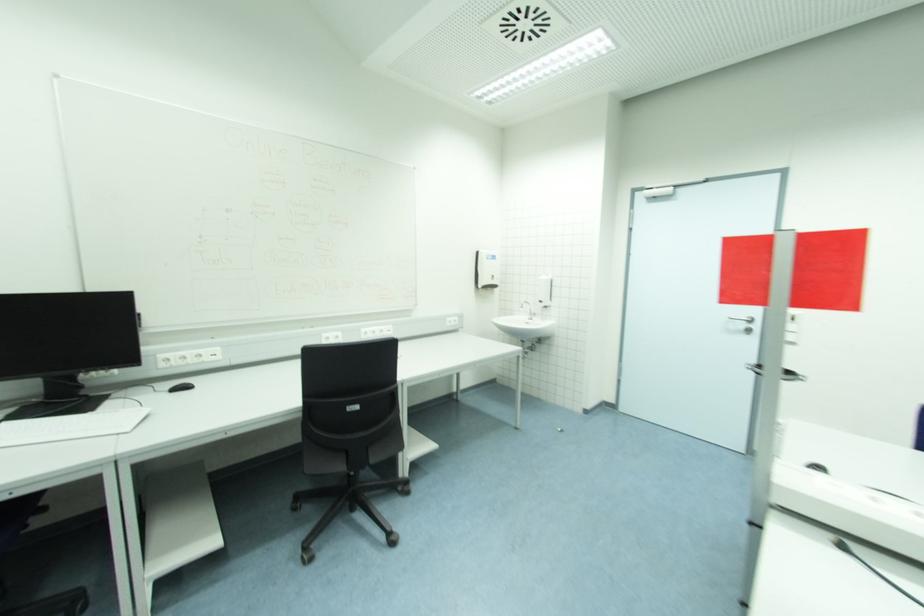
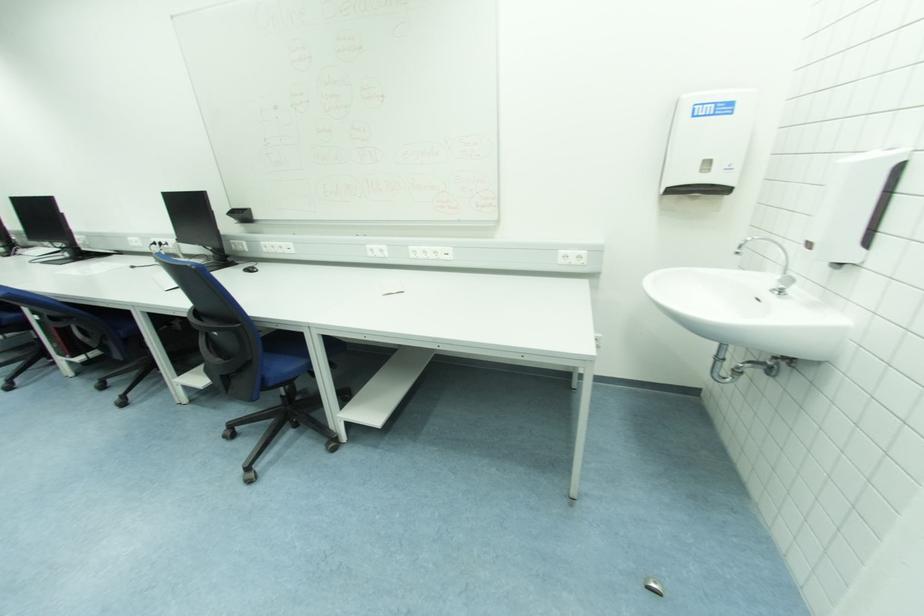
Locate, in the second image, the point that corresponds to (x=192, y=386) in the first image.

(257, 270)